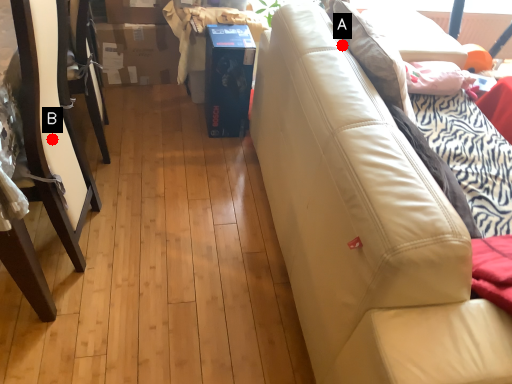
Question: Two points are circled on the image, labeled by A and B beside each circle. Which point appears closest to the camera in this image?

Choices:
 (A) A is closer
 (B) B is closer

Answer: (B)